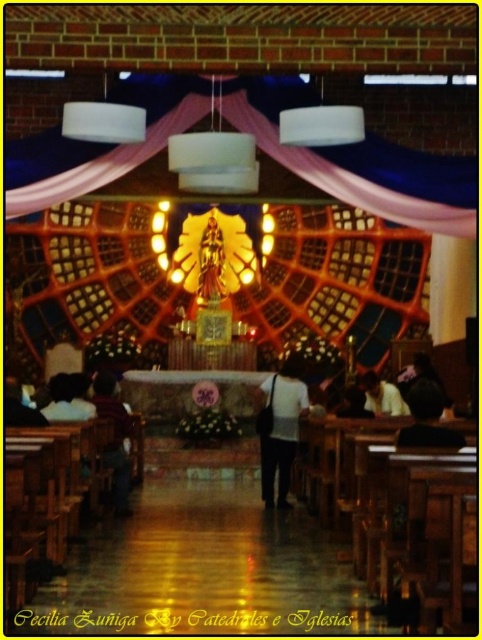
Question: Estimate the real-world distances between objects in this image. Which object is closer to the white matte shirt at center?

Choices:
 (A) dark brown leather jacket at lower left
 (B) white fabric bag at lower center

Answer: (B)

Question: Is dark brown leather jacket at lower left bigger than dark brown hair at lower right?

Choices:
 (A) yes
 (B) no

Answer: (B)

Question: Which of the following is the closest to the observer?

Choices:
 (A) (278, 426)
 (B) (124, 428)
 (C) (369, 396)
 (D) (415, 413)

Answer: (D)

Question: Does white matte shirt at center have a lesser width compared to white fabric bag at lower center?

Choices:
 (A) yes
 (B) no

Answer: (A)

Question: Among these objects, which one is nearest to the camera?

Choices:
 (A) white matte shirt at center
 (B) white fabric bag at lower center
 (C) dark brown leather jacket at lower left

Answer: (C)

Question: Does white matte shirt at center appear on the left side of dark brown hair at lower right?

Choices:
 (A) yes
 (B) no

Answer: (A)